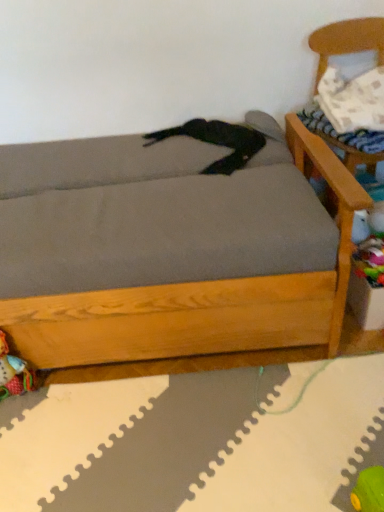
Question: Visually, is gray fabric studio couch at center positioned to the left or to the right of multicolored plastic toy at lower right, which appears as the second toy when viewed from the left?

Choices:
 (A) left
 (B) right

Answer: (A)

Question: From a real-world perspective, relative to multicolored plastic toy at lower right, which is the 1th toy in right-to-left order, is gray fabric studio couch at center vertically above or below?

Choices:
 (A) above
 (B) below

Answer: (A)

Question: Which of these objects is positioned closest to the white textured pillow at upper right?

Choices:
 (A) wooden armchair at upper right
 (B) gray fabric studio couch at center
 (C) multicolored fabric toy at lower left, marked as the 2th toy in a top-to-bottom arrangement
 (D) multicolored plastic toy at lower right, the 2th toy positioned from the bottom

Answer: (A)

Question: Considering the real-world distances, which object is closest to the wooden armchair at upper right?

Choices:
 (A) gray fabric studio couch at center
 (B) multicolored plastic toy at lower right, which is the 1th toy in right-to-left order
 (C) multicolored fabric toy at lower left, the 1th toy positioned from the left
 (D) white textured pillow at upper right

Answer: (D)